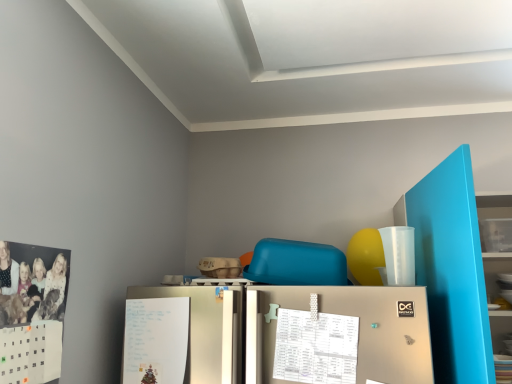
The image size is (512, 384). I want to click on white paper calendar at center, so click(315, 347).

Locate an element on the screen. Image resolution: width=512 pixels, height=384 pixels. white paper at lower left is located at coordinates (209, 330).

Image resolution: width=512 pixels, height=384 pixels. Find the location of `matte blue bookshelf at right`. matte blue bookshelf at right is located at coordinates (451, 269).

The image size is (512, 384). What are the coordinates of `white paper calendar at center` in the screenshot? It's located at (315, 347).

From the image's perspective, would you say matte blue bookshelf at right is shown under white paper calendar at center?

No, from the image's perspective, matte blue bookshelf at right is not beneath white paper calendar at center.

Would you say matte blue bookshelf at right is outside white paper calendar at center?

Yes.

Relative to white paper calendar at center, is matte blue bookshelf at right in front or behind?

In the image, matte blue bookshelf at right appears in front of white paper calendar at center.

Between matte blue bookshelf at right and white paper calendar at center, which one appears on the right side from the viewer's perspective?

From the viewer's perspective, matte blue bookshelf at right appears more on the right side.

From a real-world perspective, is white paper calendar at center over matte blue bookshelf at right?

No, from a real-world perspective, white paper calendar at center is not over matte blue bookshelf at right

Considering the positions of point (350, 371) and point (474, 266), is point (350, 371) closer or farther from the camera than point (474, 266)?

Point (350, 371) is positioned farther from the camera compared to point (474, 266).

Is white paper calendar at center in contact with matte blue bookshelf at right?

They are not placed beside each other.

Is white paper calendar at center completely or partially outside of matte blue bookshelf at right?

Yes.

Is white paper calendar at center next to white paper at lower left?

white paper calendar at center and white paper at lower left are clearly separated.

Can you tell me how much white paper calendar at center and white paper at lower left differ in facing direction?

The facing directions of white paper calendar at center and white paper at lower left are 1 degrees apart.

In the scene shown: Is white paper calendar at center taller than white paper at lower left?

No.

From the image's perspective, between white paper calendar at center and white paper at lower left, which one is located above?

white paper calendar at center, from the image's perspective.

Does white paper at lower left lie in front of matte blue bookshelf at right?

No, white paper at lower left is further to the viewer.

Is white paper at lower left situated inside matte blue bookshelf at right or outside?

white paper at lower left exists outside the volume of matte blue bookshelf at right.

Looking at the image, does white paper at lower left seem bigger or smaller compared to matte blue bookshelf at right?

white paper at lower left is smaller than matte blue bookshelf at right.

This screenshot has width=512, height=384. In order to click on bookshelf above the white paper at lower left (from the image's perspective) in this screenshot , I will do `click(451, 269)`.

Choose the correct answer: Is matte blue bookshelf at right inside white paper at lower left or outside it?

matte blue bookshelf at right is located beyond the bounds of white paper at lower left.

Which of these two, matte blue bookshelf at right or white paper at lower left, is bigger?

matte blue bookshelf at right.

Is matte blue bookshelf at right closer to the viewer compared to white paper at lower left?

That is True.

Is white paper at lower left bigger or smaller than white paper calendar at center?

white paper at lower left is bigger than white paper calendar at center.

From the picture: From a real-world perspective, is white paper at lower left beneath white paper calendar at center?

Yes, from a real-world perspective, white paper at lower left is under white paper calendar at center.

Is white paper at lower left in front of or behind white paper calendar at center in the image?

Visually, white paper at lower left is located behind white paper calendar at center.

Where is `bookshelf located on the right of white paper calendar at center`? The image size is (512, 384). bookshelf located on the right of white paper calendar at center is located at coordinates (451, 269).

Locate an element on the screen. The image size is (512, 384). calendar lying behind the matte blue bookshelf at right is located at coordinates (315, 347).

Which object lies further to the anchor point white paper calendar at center, white paper at lower left or matte blue bookshelf at right?

Based on the image, matte blue bookshelf at right appears to be further to white paper calendar at center.

Which object lies nearer to the anchor point white paper calendar at center, matte blue bookshelf at right or white paper at lower left?

white paper at lower left is closer to white paper calendar at center.

Based on their spatial positions, is white paper calendar at center or matte blue bookshelf at right further from white paper at lower left?

matte blue bookshelf at right is positioned further to the anchor white paper at lower left.

Based on the photo, considering their positions, is white paper at lower left positioned further to matte blue bookshelf at right than white paper calendar at center?

Among the two, white paper at lower left is located further to matte blue bookshelf at right.

Based on their spatial positions, is white paper calendar at center or white paper at lower left further from matte blue bookshelf at right?

white paper at lower left is further to matte blue bookshelf at right.

Estimate the real-world distances between objects in this image. Which object is further from white paper at lower left, matte blue bookshelf at right or white paper calendar at center?

matte blue bookshelf at right.

This screenshot has height=384, width=512. Find the location of `calendar between white paper at lower left and matte blue bookshelf at right`. calendar between white paper at lower left and matte blue bookshelf at right is located at coordinates (315, 347).